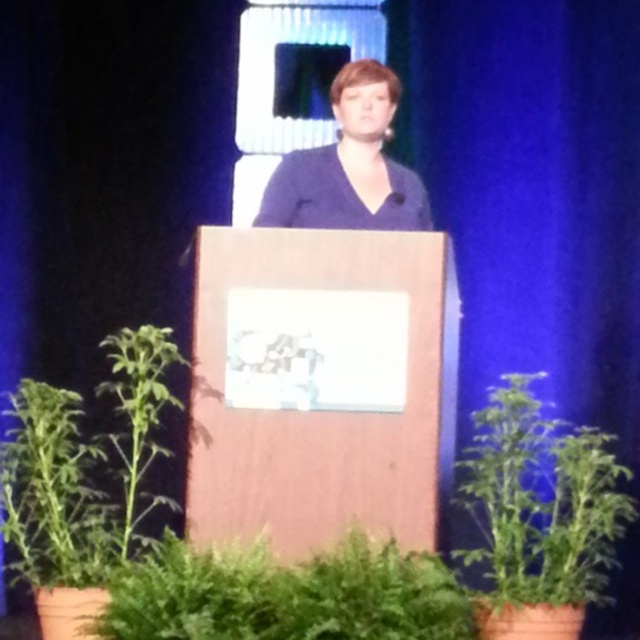
Question: Among these objects, which one is farthest from the camera?

Choices:
 (A) green leafy plant at lower right
 (B) green leafy plant at lower center

Answer: (A)

Question: Does green leafy plant at lower left appear over blue matte dress at center?

Choices:
 (A) yes
 (B) no

Answer: (B)

Question: Which object appears closest to the camera in this image?

Choices:
 (A) green leafy plant at lower left
 (B) green leafy plant at lower center

Answer: (B)

Question: Which object is closer to the camera taking this photo?

Choices:
 (A) green leafy plant at lower center
 (B) blue matte dress at center
 (C) green leafy plant at lower left
 (D) green leafy plant at lower right

Answer: (A)

Question: Is green leafy plant at lower left bigger than blue matte dress at center?

Choices:
 (A) no
 (B) yes

Answer: (B)

Question: From the image, what is the correct spatial relationship of green leafy plant at lower left in relation to green leafy plant at lower right?

Choices:
 (A) above
 (B) below

Answer: (A)